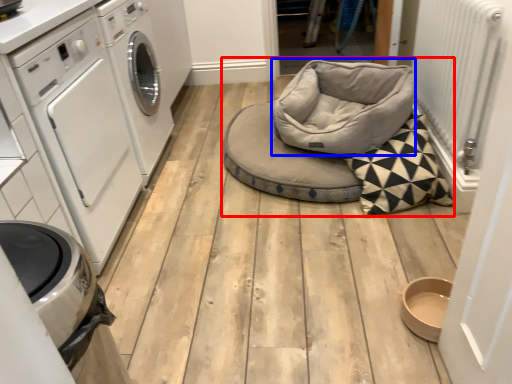
Question: Which of the following is the closest to the observer, daybed (highlighted by a red box) or bean bag chair (highlighted by a blue box)?

Choices:
 (A) daybed
 (B) bean bag chair

Answer: (B)